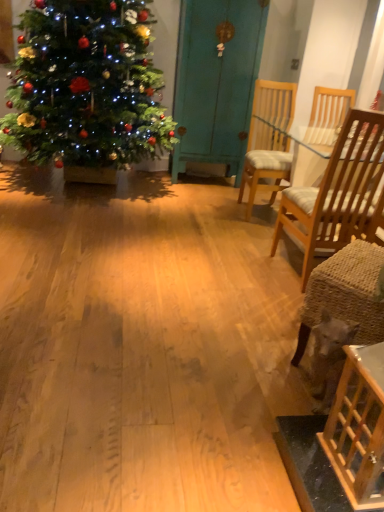
Question: Could you tell me if teal painted wood armoire at center is facing light brown wood chair at right, which is the first chair from front to back?

Choices:
 (A) no
 (B) yes

Answer: (B)

Question: Does teal painted wood armoire at center have a greater height compared to light brown wood chair at right, positioned as the 2th chair in back-to-front order?

Choices:
 (A) no
 (B) yes

Answer: (B)

Question: Is there a large distance between teal painted wood armoire at center and light brown wood chair at right, which is the first chair from front to back?

Choices:
 (A) yes
 (B) no

Answer: (A)

Question: Is light brown wood chair at right, positioned as the 2th chair in back-to-front order, completely or partially inside teal painted wood armoire at center?

Choices:
 (A) yes
 (B) no

Answer: (B)

Question: From a real-world perspective, is teal painted wood armoire at center positioned under light brown wood chair at right, positioned as the 2th chair in back-to-front order, based on gravity?

Choices:
 (A) yes
 (B) no

Answer: (B)

Question: From the image's perspective, is teal painted wood armoire at center above or below light brown wood chair at right, positioned as the 2th chair in back-to-front order?

Choices:
 (A) below
 (B) above

Answer: (B)

Question: Considering the positions of point (193, 64) and point (382, 121), is point (193, 64) closer or farther from the camera than point (382, 121)?

Choices:
 (A) farther
 (B) closer

Answer: (A)

Question: Based on their positions, is teal painted wood armoire at center located to the left or right of light brown wood chair at right, which is the first chair from front to back?

Choices:
 (A) left
 (B) right

Answer: (A)

Question: Which is correct: teal painted wood armoire at center is inside light brown wood chair at right, positioned as the 2th chair in back-to-front order, or outside of it?

Choices:
 (A) outside
 (B) inside

Answer: (A)

Question: Is shiny green christmas tree at left in front of or behind wooden table at lower right in the image?

Choices:
 (A) front
 (B) behind

Answer: (B)

Question: Looking at the image, does shiny green christmas tree at left seem bigger or smaller compared to wooden table at lower right?

Choices:
 (A) small
 (B) big

Answer: (B)

Question: Is point (172, 16) positioned closer to the camera than point (357, 430)?

Choices:
 (A) farther
 (B) closer

Answer: (A)

Question: From a real-world perspective, is shiny green christmas tree at left physically located above or below wooden table at lower right?

Choices:
 (A) below
 (B) above

Answer: (B)

Question: From the image's perspective, is light brown wood chair at right, positioned as the 2th chair in back-to-front order, positioned above or below shiny green christmas tree at left?

Choices:
 (A) above
 (B) below

Answer: (B)

Question: Based on their sizes in the image, would you say light brown wood chair at right, which is the first chair from front to back, is bigger or smaller than shiny green christmas tree at left?

Choices:
 (A) big
 (B) small

Answer: (B)